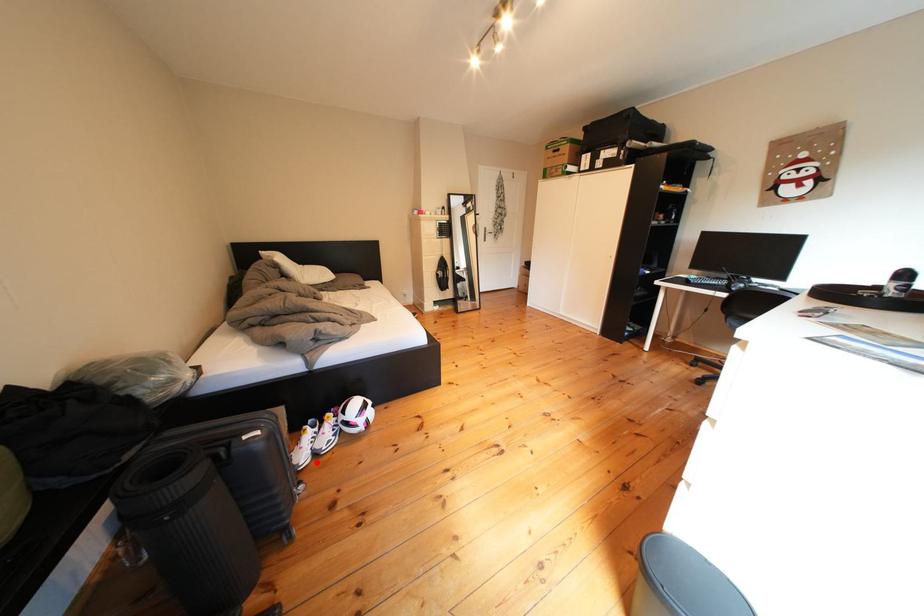
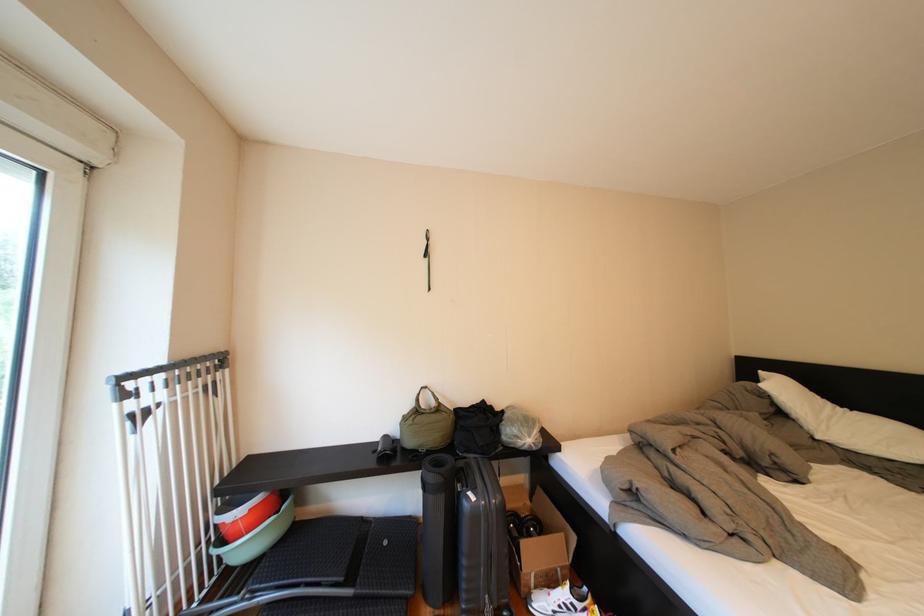
Where in the second image is the point corresponding to the highlighted location from the first image?

(554, 609)